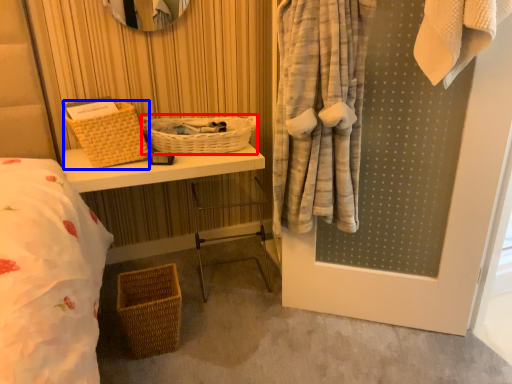
Question: Which of the following is the closest to the observer, basket (highlighted by a red box) or basket (highlighted by a blue box)?

Choices:
 (A) basket
 (B) basket

Answer: (B)